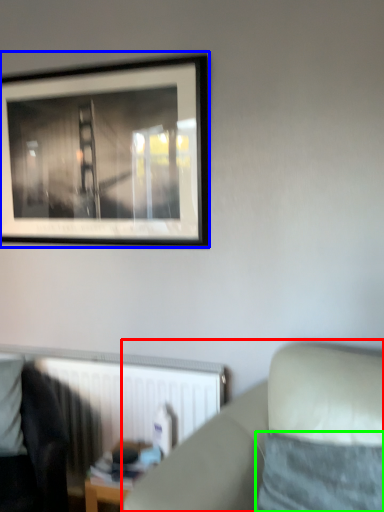
Question: Which object is positioned closest to studio couch (highlighted by a red box)? Select from picture frame (highlighted by a blue box) and pillow (highlighted by a green box).

Choices:
 (A) picture frame
 (B) pillow

Answer: (B)